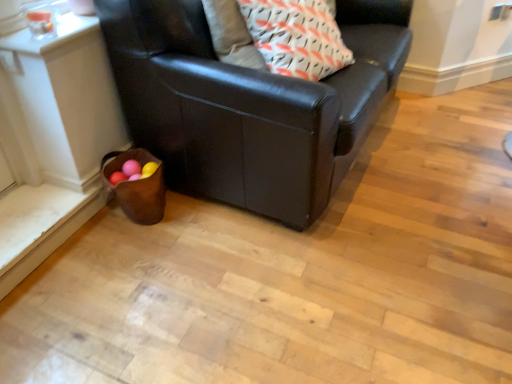
What is the approximate width of white with orange and black patterned pillow at upper center?

white with orange and black patterned pillow at upper center is 15.00 inches in width.

You are a GUI agent. You are given a task and a screenshot of the screen. Output one action in this format:
    pyautogui.click(x=<x>, y=<y>)
    Task: Click on the white with orange and black patterned pillow at upper center
    
    Given the screenshot: What is the action you would take?
    pyautogui.click(x=296, y=37)

What do you see at coordinates (296, 37) in the screenshot?
I see `white with orange and black patterned pillow at upper center` at bounding box center [296, 37].

Locate an element on the screen. The image size is (512, 384). black leather couch at lower left is located at coordinates (250, 105).

The height and width of the screenshot is (384, 512). Describe the element at coordinates (250, 105) in the screenshot. I see `black leather couch at lower left` at that location.

The width and height of the screenshot is (512, 384). In order to click on white with orange and black patterned pillow at upper center in this screenshot , I will do `click(296, 37)`.

Considering the relative positions of white with orange and black patterned pillow at upper center and black leather couch at lower left in the image provided, is white with orange and black patterned pillow at upper center to the left of black leather couch at lower left from the viewer's perspective?

In fact, white with orange and black patterned pillow at upper center is to the right of black leather couch at lower left.

From the picture: Which object is further away from the camera taking this photo, white with orange and black patterned pillow at upper center or black leather couch at lower left?

white with orange and black patterned pillow at upper center is further away from the camera.

Considering the positions of points (308, 57) and (280, 107), is point (308, 57) closer to camera compared to point (280, 107)?

No, it is behind (280, 107).

Consider the image. From the image's perspective, relative to black leather couch at lower left, is white with orange and black patterned pillow at upper center above or below?

white with orange and black patterned pillow at upper center is situated lower than black leather couch at lower left in the image.

From a real-world perspective, is white with orange and black patterned pillow at upper center beneath black leather couch at lower left?

No.

Considering the sizes of white with orange and black patterned pillow at upper center and black leather couch at lower left in the image, is white with orange and black patterned pillow at upper center wider or thinner than black leather couch at lower left?

white with orange and black patterned pillow at upper center is thinner than black leather couch at lower left.

Considering the sizes of objects white with orange and black patterned pillow at upper center and black leather couch at lower left in the image provided, who is taller, white with orange and black patterned pillow at upper center or black leather couch at lower left?

black leather couch at lower left.

Is white with orange and black patterned pillow at upper center smaller than black leather couch at lower left?

Yes.

Is white with orange and black patterned pillow at upper center inside the boundaries of black leather couch at lower left, or outside?

The correct answer is: inside.

Is white with orange and black patterned pillow at upper center next to black leather couch at lower left and touching it?

No, white with orange and black patterned pillow at upper center is not making contact with black leather couch at lower left.

Is white with orange and black patterned pillow at upper center oriented away from black leather couch at lower left?

Correct, white with orange and black patterned pillow at upper center is looking away from black leather couch at lower left.

Where is `throw pillow above the black leather couch at lower left (from a real-world perspective)`? Image resolution: width=512 pixels, height=384 pixels. throw pillow above the black leather couch at lower left (from a real-world perspective) is located at coordinates click(x=296, y=37).

Which object is positioned more to the right, black leather couch at lower left or white with orange and black patterned pillow at upper center?

Positioned to the right is white with orange and black patterned pillow at upper center.

In the scene shown: In the image, is black leather couch at lower left positioned in front of or behind white with orange and black patterned pillow at upper center?

In the image, black leather couch at lower left appears in front of white with orange and black patterned pillow at upper center.

Which point is more distant from viewer, (x=268, y=118) or (x=314, y=61)?

The point (x=314, y=61) is behind.

From the image's perspective, between black leather couch at lower left and white with orange and black patterned pillow at upper center, which one is located above?

black leather couch at lower left is shown above in the image.

From a real-world perspective, is black leather couch at lower left over white with orange and black patterned pillow at upper center?

No, from a real-world perspective, black leather couch at lower left is not on top of white with orange and black patterned pillow at upper center.

Is black leather couch at lower left wider than white with orange and black patterned pillow at upper center?

Result: Yes, black leather couch at lower left is wider than white with orange and black patterned pillow at upper center.

Does black leather couch at lower left have a greater height compared to white with orange and black patterned pillow at upper center?

Yes, black leather couch at lower left is taller than white with orange and black patterned pillow at upper center.

Who is bigger, black leather couch at lower left or white with orange and black patterned pillow at upper center?

With larger size is black leather couch at lower left.

Which is correct: black leather couch at lower left is inside white with orange and black patterned pillow at upper center, or outside of it?

black leather couch at lower left is located beyond the bounds of white with orange and black patterned pillow at upper center.

Based on the photo, would you say black leather couch at lower left is a long distance from white with orange and black patterned pillow at upper center?

That's not correct — black leather couch at lower left is a little close to white with orange and black patterned pillow at upper center.

Is black leather couch at lower left looking in the opposite direction of white with orange and black patterned pillow at upper center?

Absolutely, black leather couch at lower left is directed away from white with orange and black patterned pillow at upper center.

You are a GUI agent. You are given a task and a screenshot of the screen. Output one action in this format:
    pyautogui.click(x=<x>, y=<y>)
    Task: Click on the throw pillow lying below the black leather couch at lower left (from the image's perspective)
    
    Given the screenshot: What is the action you would take?
    pyautogui.click(x=296, y=37)

Locate an element on the screen. This screenshot has width=512, height=384. throw pillow located behind the black leather couch at lower left is located at coordinates (296, 37).

Find the location of a particular element. The height and width of the screenshot is (384, 512). throw pillow on the right of black leather couch at lower left is located at coordinates (296, 37).